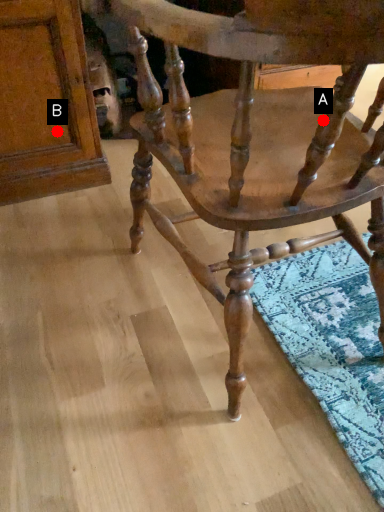
Question: Two points are circled on the image, labeled by A and B beside each circle. Among these points, which one is nearest to the camera?

Choices:
 (A) A is closer
 (B) B is closer

Answer: (A)